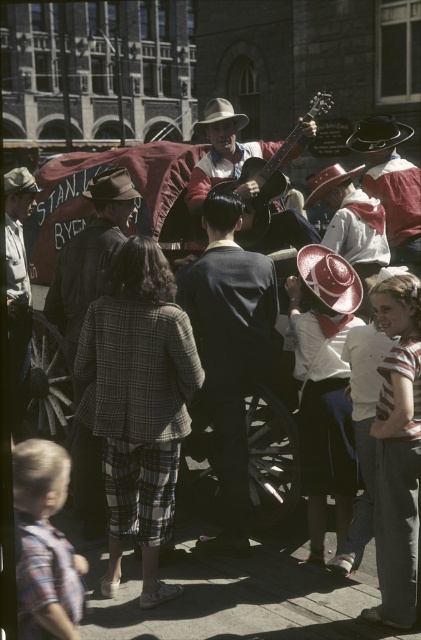
Does matte black cowboy hat at center appear under light brown felt cowboy hat at center?

Indeed, matte black cowboy hat at center is positioned under light brown felt cowboy hat at center.

Is point (397, 128) closer to viewer compared to point (204, 118)?

That is True.

At what (x,y) coordinates should I click in order to perform the action: click on matte black cowboy hat at center. Please return your answer as a coordinate pair (x, y). Looking at the image, I should click on (378, 132).

Consider the image. Between dark blue suit at center and reddish-brown leather hat at upper right, which one is positioned lower?

dark blue suit at center is below.

Which is in front, point (199, 289) or point (405, 204)?

Point (199, 289) is more forward.

The width and height of the screenshot is (421, 640). What are the coordinates of `dark blue suit at center` in the screenshot? It's located at (229, 352).

Which is more to the left, reddish-brown leather hat at upper right or matte black cowboy hat at center?

Positioned to the left is matte black cowboy hat at center.

Does point (368, 141) come in front of point (373, 132)?

No, (368, 141) is behind (373, 132).

Identify the location of reddish-brown leather hat at upper right. The image size is (421, 640). (391, 184).